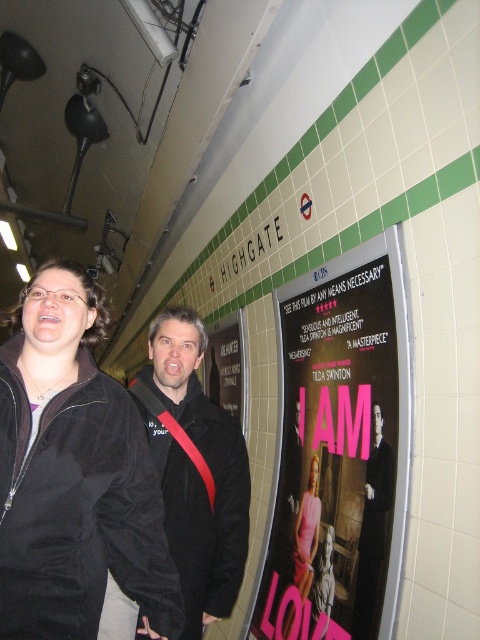
Can you confirm if velvet black jacket at center is positioned to the left of black matte jacket at center?

Yes, velvet black jacket at center is to the left of black matte jacket at center.

Does velvet black jacket at center have a smaller size compared to black matte jacket at center?

Indeed, velvet black jacket at center has a smaller size compared to black matte jacket at center.

The image size is (480, 640). What do you see at coordinates (73, 474) in the screenshot? I see `velvet black jacket at center` at bounding box center [73, 474].

This screenshot has width=480, height=640. What are the coordinates of `velvet black jacket at center` in the screenshot? It's located at 73,474.

Is black matte jacket at center shorter than black matte suit at center?

Incorrect, black matte jacket at center's height does not fall short of black matte suit at center's.

Is black matte jacket at center closer to camera compared to black matte suit at center?

Yes, black matte jacket at center is in front of black matte suit at center.

Between point (188, 433) and point (367, 614), which one is positioned behind?

Point (188, 433)

The height and width of the screenshot is (640, 480). In order to click on black matte jacket at center in this screenshot , I will do `click(195, 468)`.

From the picture: Who is taller, black matte suit at center or pink satin dress at center?

pink satin dress at center

Is point (382, 458) positioned before point (283, 627)?

That is True.

The image size is (480, 640). Find the location of `black matte suit at center`. black matte suit at center is located at coordinates (372, 529).